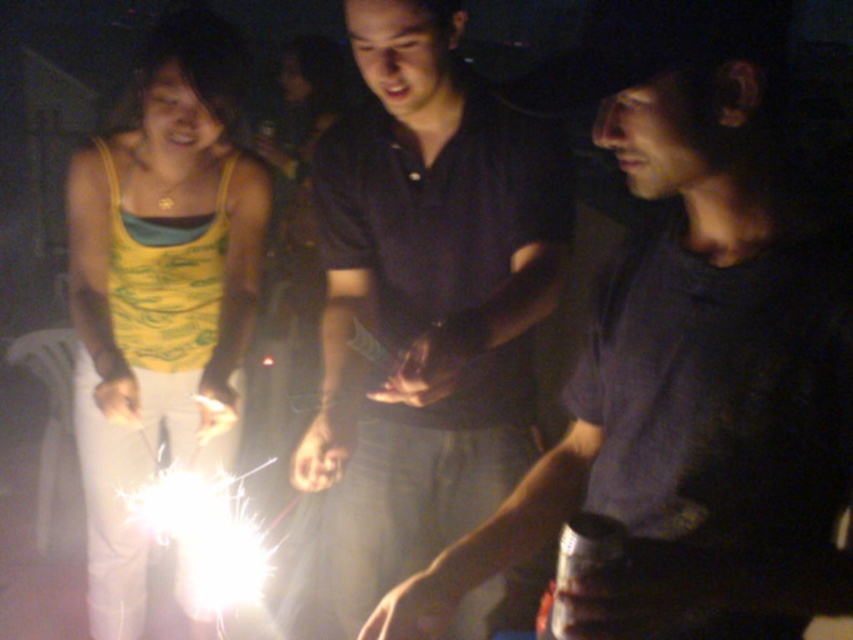
You are a photographer trying to capture both the matte black shirt at center and the dark purple shirt at center in a single frame. Given that your camera has a minimum focus distance of 17 inches, will you be able to focus on both subjects simultaneously?

The matte black shirt at center and dark purple shirt at center are 16.99 inches apart from each other, which is just under the camera lens minimum focus distance of 17 inches. Therefore, the photographer will not be able to focus on both subjects simultaneously.

You are standing at the point labeled point (442,198) and want to walk to the point labeled point (202,621). Can you walk directly towards it without moving around any obstacles?

Yes, you can walk directly towards point (202,621) from point (442,198) because the first point is in front of the second point, meaning there are no obstacles blocking the path between them.

You are at a nighttime gathering and see two people in the middle ground wearing a matte black shirt at center and a dark purple shirt at center. Which one is more to the right?

The matte black shirt at center is positioned on the right side of dark purple shirt at center, so the matte black shirt at center is more to the right.